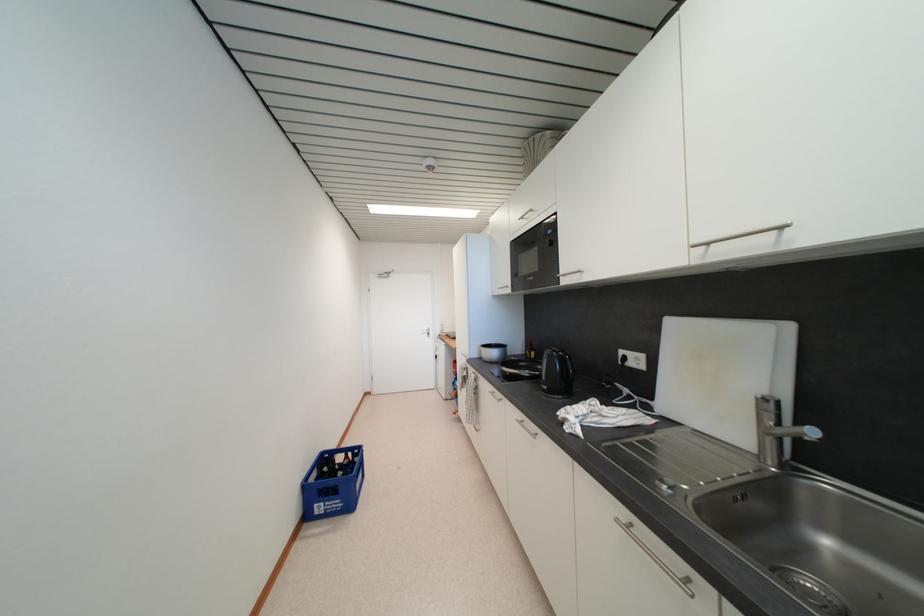
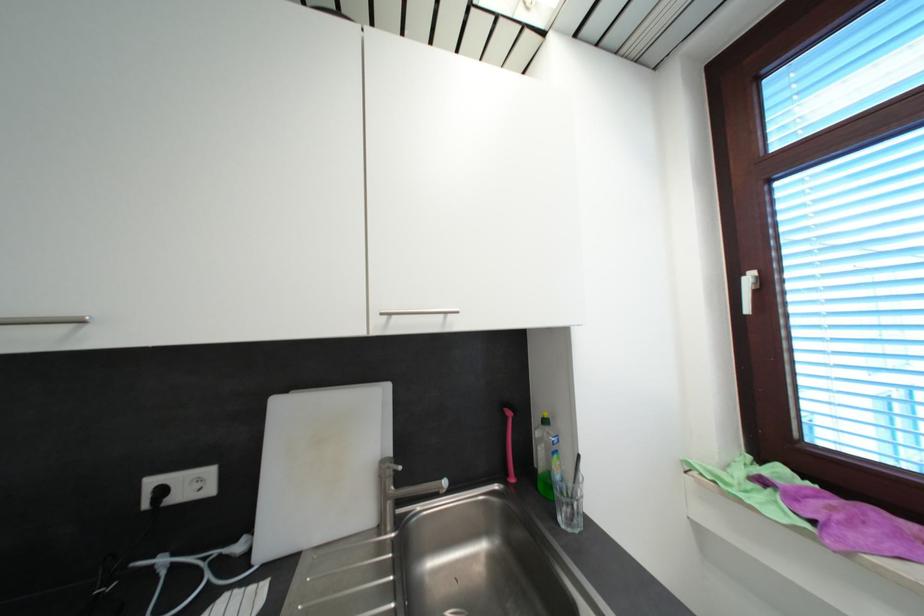
Question: Based on the continuous images, in which direction is the camera rotating? Reply with the corresponding letter.

Choices:
 (A) Left
 (B) Right
 (C) Up
 (D) Down

Answer: (B)